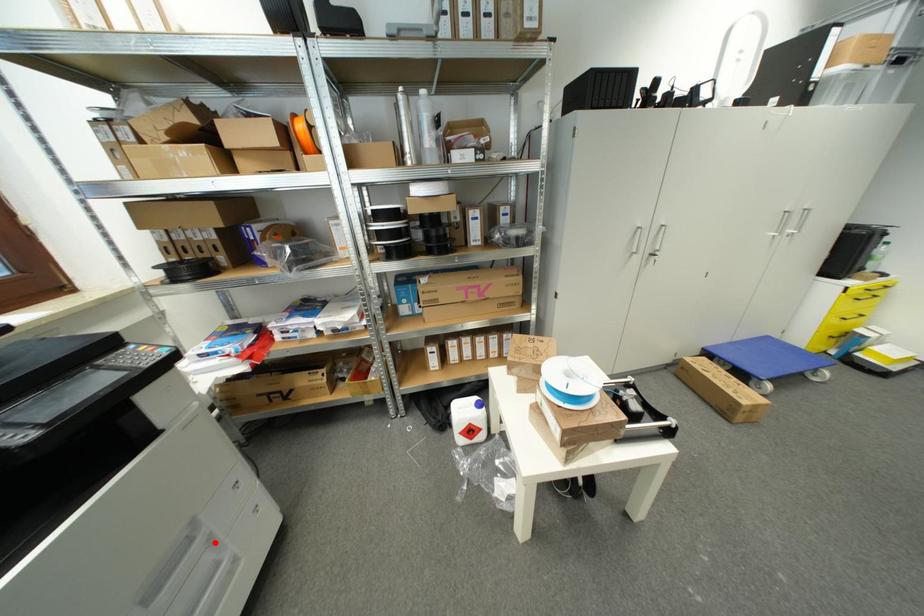
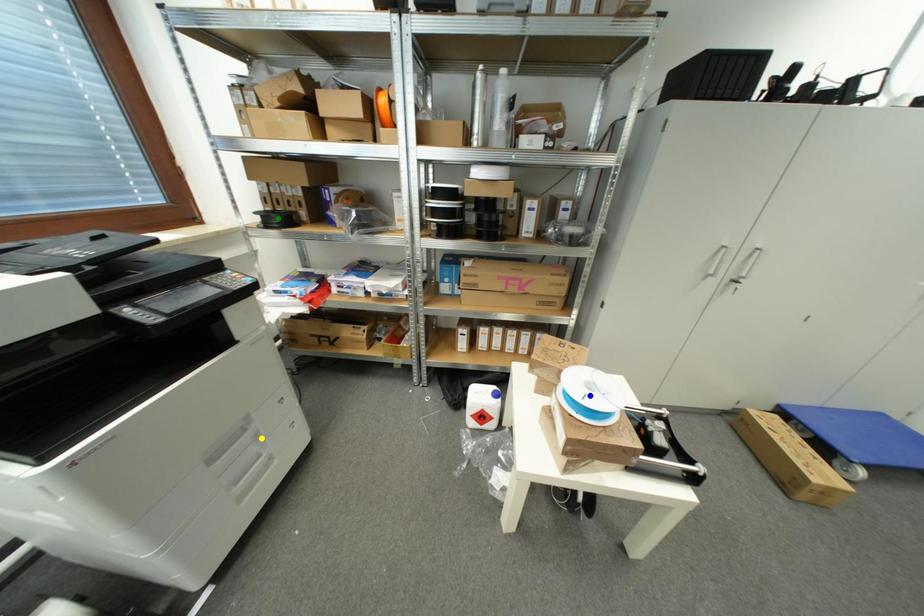
Question: I am providing you with two images of the same scene from different viewpoints. A red point is marked on the first image. You are given multiple points on the second image. Which point in image 2 represents the same 3d spot as the red point in image 1?

Choices:
 (A) blue point
 (B) yellow point
 (C) green point

Answer: (B)